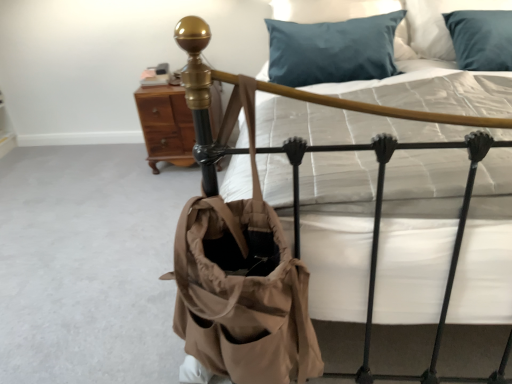
Question: Does teal satin pillow at upper center contain brown wood nightstand at upper left?

Choices:
 (A) yes
 (B) no

Answer: (B)

Question: Is the position of teal satin pillow at upper center more distant than that of brown wood nightstand at upper left?

Choices:
 (A) yes
 (B) no

Answer: (B)

Question: Is teal satin pillow at upper center to the left of brown wood nightstand at upper left from the viewer's perspective?

Choices:
 (A) yes
 (B) no

Answer: (B)

Question: Considering the relative sizes of teal satin pillow at upper center and brown wood nightstand at upper left in the image provided, is teal satin pillow at upper center bigger than brown wood nightstand at upper left?

Choices:
 (A) yes
 (B) no

Answer: (A)

Question: Would you say teal satin pillow at upper center is outside brown wood nightstand at upper left?

Choices:
 (A) yes
 (B) no

Answer: (A)

Question: Can you confirm if teal satin pillow at upper center is thinner than brown wood nightstand at upper left?

Choices:
 (A) no
 (B) yes

Answer: (A)

Question: Is brown wood nightstand at upper left in contact with teal satin pillow at upper center?

Choices:
 (A) no
 (B) yes

Answer: (A)

Question: Can you confirm if brown wood nightstand at upper left is wider than teal satin pillow at upper center?

Choices:
 (A) yes
 (B) no

Answer: (B)

Question: From the image's perspective, is brown wood nightstand at upper left beneath teal satin pillow at upper center?

Choices:
 (A) yes
 (B) no

Answer: (A)

Question: Can you confirm if brown wood nightstand at upper left is bigger than teal satin pillow at upper center?

Choices:
 (A) no
 (B) yes

Answer: (A)

Question: Considering the relative sizes of brown wood nightstand at upper left and teal satin pillow at upper center in the image provided, is brown wood nightstand at upper left taller than teal satin pillow at upper center?

Choices:
 (A) yes
 (B) no

Answer: (A)

Question: Is brown wood nightstand at upper left located outside teal satin pillow at upper center?

Choices:
 (A) yes
 (B) no

Answer: (A)

Question: Does brown wood nightstand at upper left appear on the right side of tan canvas tote at center?

Choices:
 (A) no
 (B) yes

Answer: (A)